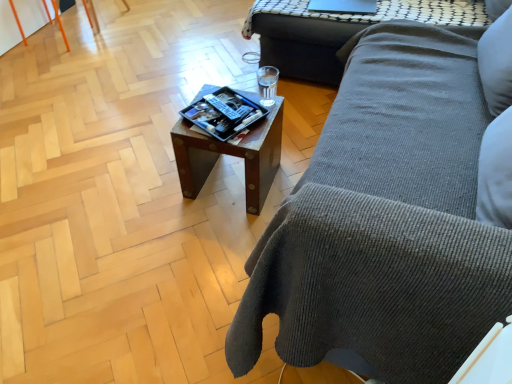
Question: Would you say wooden tray at center, acting as the 2th table starting from the back, is outside wooden side table at upper right, the 1th table from the back?

Choices:
 (A) no
 (B) yes

Answer: (B)

Question: From the image's perspective, is wooden tray at center, acting as the 2th table starting from the back, above wooden side table at upper right, which ranks as the first table in top-to-bottom order?

Choices:
 (A) no
 (B) yes

Answer: (A)

Question: From the image's perspective, does wooden tray at center, positioned as the 2th table in top-to-bottom order, appear lower than wooden side table at upper right, which ranks as the first table in top-to-bottom order?

Choices:
 (A) yes
 (B) no

Answer: (A)

Question: Is wooden tray at center, the 1th table when ordered from bottom to top, placed right next to wooden side table at upper right, which ranks as the first table in top-to-bottom order?

Choices:
 (A) yes
 (B) no

Answer: (B)

Question: From a real-world perspective, is wooden tray at center, acting as the 2th table starting from the back, physically above wooden side table at upper right, which ranks as the first table in top-to-bottom order?

Choices:
 (A) yes
 (B) no

Answer: (B)

Question: Is point (423, 357) closer or farther from the camera than point (311, 4)?

Choices:
 (A) closer
 (B) farther

Answer: (A)

Question: Visually, is gray corduroy couch at center positioned to the left or to the right of sleek black laptop at upper center?

Choices:
 (A) right
 (B) left

Answer: (A)

Question: Do you think gray corduroy couch at center is within sleek black laptop at upper center, or outside of it?

Choices:
 (A) inside
 (B) outside

Answer: (B)

Question: From the image's perspective, is gray corduroy couch at center above or below sleek black laptop at upper center?

Choices:
 (A) below
 (B) above

Answer: (A)

Question: Does point (289, 29) appear closer or farther from the camera than point (325, 1)?

Choices:
 (A) farther
 (B) closer

Answer: (B)

Question: From the image's perspective, relative to sleek black laptop at upper center, is wooden side table at upper right, the 1th table positioned from the right, above or below?

Choices:
 (A) above
 (B) below

Answer: (A)

Question: In terms of width, does wooden side table at upper right, the 1th table positioned from the right, look wider or thinner when compared to sleek black laptop at upper center?

Choices:
 (A) thin
 (B) wide

Answer: (B)

Question: Is wooden side table at upper right, marked as the second table in a left-to-right arrangement, taller or shorter than sleek black laptop at upper center?

Choices:
 (A) tall
 (B) short

Answer: (A)

Question: From a real-world perspective, relative to wooden side table at upper right, marked as the second table in a left-to-right arrangement, is wooden tray at center, acting as the 2th table starting from the back, vertically above or below?

Choices:
 (A) above
 (B) below

Answer: (B)

Question: Looking at their shapes, would you say wooden tray at center, acting as the 2th table starting from the right, is wider or thinner than wooden side table at upper right, the 1th table from the back?

Choices:
 (A) thin
 (B) wide

Answer: (A)